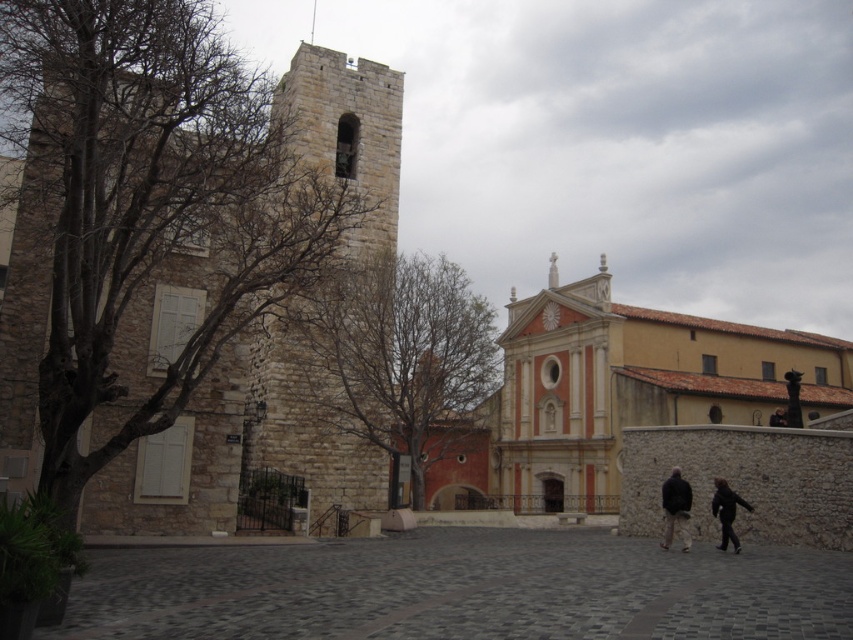
Between point (292, 86) and point (775, 410), which one is positioned in front?

Point (292, 86)

The width and height of the screenshot is (853, 640). What do you see at coordinates (349, 132) in the screenshot?
I see `stone textured bell tower at center` at bounding box center [349, 132].

Who is more forward, (310,442) or (782,420)?

Point (310,442)

The width and height of the screenshot is (853, 640). What are the coordinates of `stone textured bell tower at center` in the screenshot? It's located at (349, 132).

Does point (683, 536) come in front of point (717, 483)?

Yes, point (683, 536) is closer to viewer.

Does dark brown leather jacket at lower right appear over black matte jacket at lower right?

No, dark brown leather jacket at lower right is not above black matte jacket at lower right.

Describe the element at coordinates (676, 508) in the screenshot. I see `dark brown leather jacket at lower right` at that location.

Identify the location of dark brown leather jacket at lower right. (676, 508).

Does stone tower at left appear on the right side of dark brown leather jacket at lower right?

Incorrect, stone tower at left is not on the right side of dark brown leather jacket at lower right.

Is stone tower at left positioned before dark brown leather jacket at lower right?

Yes, stone tower at left is in front of dark brown leather jacket at lower right.

Who is more forward, (378, 96) or (665, 518)?

Positioned in front is point (665, 518).

Image resolution: width=853 pixels, height=640 pixels. I want to click on stone tower at left, so coord(231,449).